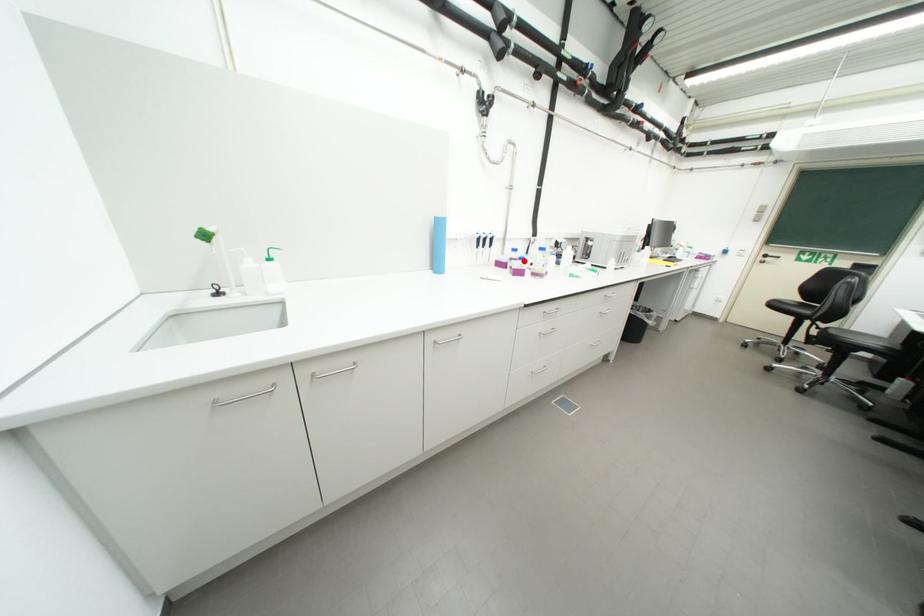
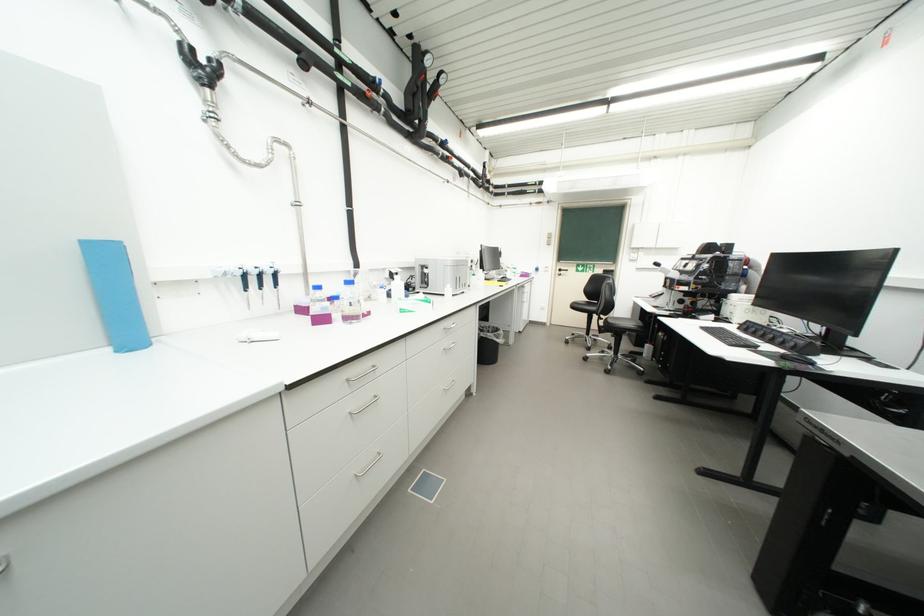
Where in the second image is the point corresponding to the highlighted location from the first image?

(330, 302)